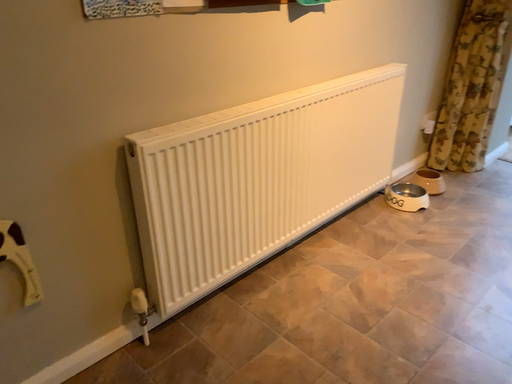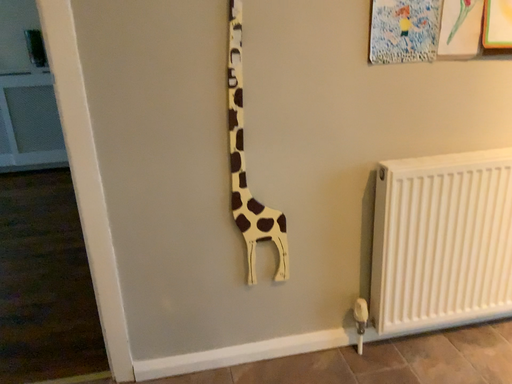
Question: How did the camera likely rotate when shooting the video?

Choices:
 (A) rotated right
 (B) rotated left

Answer: (B)